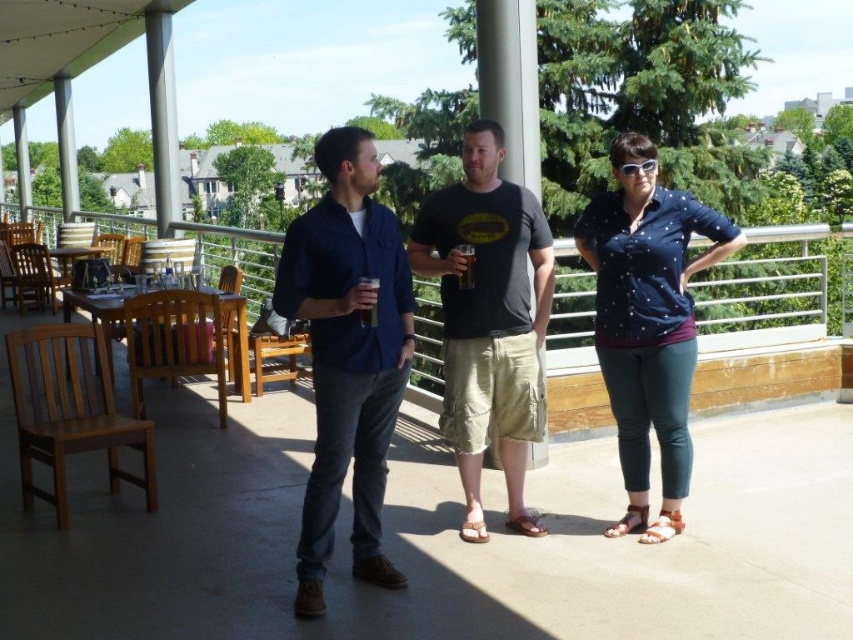
Is navy blue shirt at center behind translucent glass at center?

No, navy blue shirt at center is in front of translucent glass at center.

Between navy blue shirt at center and translucent glass at center, which one appears on the right side from the viewer's perspective?

From the viewer's perspective, navy blue shirt at center appears more on the right side.

Does point (712, 211) come closer to viewer compared to point (467, 280)?

Yes, point (712, 211) is in front of point (467, 280).

At what (x,y) coordinates should I click in order to perform the action: click on navy blue shirt at center. Please return your answer as a coordinate pair (x, y). This screenshot has width=853, height=640. Looking at the image, I should click on (647, 321).

Does dark gray t-shirt at center appear on the right side of navy blue shirt at center?

No, dark gray t-shirt at center is not to the right of navy blue shirt at center.

This screenshot has height=640, width=853. In order to click on dark gray t-shirt at center in this screenshot , I will do `click(488, 320)`.

Can you confirm if matte blue shirt at center is taller than dark gray t-shirt at center?

In fact, matte blue shirt at center may be shorter than dark gray t-shirt at center.

Where is `matte blue shirt at center`? The width and height of the screenshot is (853, 640). matte blue shirt at center is located at coordinates (347, 353).

Between point (308, 304) and point (503, 476), which one is positioned behind?

The point (503, 476) is behind.

Identify the location of matte blue shirt at center. (347, 353).